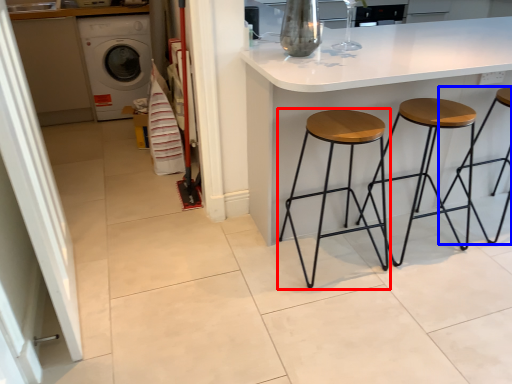
Question: Which object is further to the camera taking this photo, stool (highlighted by a red box) or stool (highlighted by a blue box)?

Choices:
 (A) stool
 (B) stool

Answer: (B)